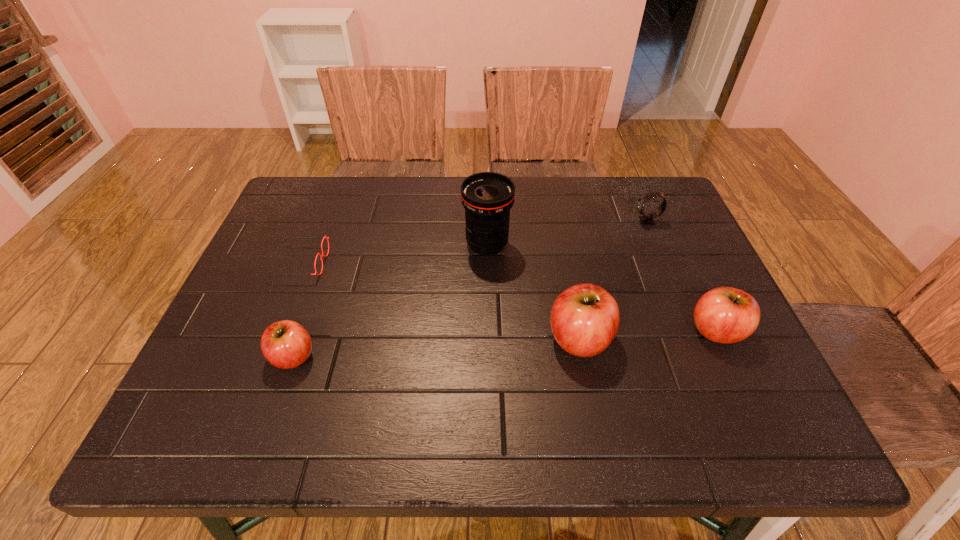
You are a GUI agent. You are given a task and a screenshot of the screen. Output one action in this format:
    pyautogui.click(x=<x>, y=<y>)
    Task: Click on the vacant space at the near right corner of the desktop
    
    Given the screenshot: What is the action you would take?
    pyautogui.click(x=762, y=395)

The height and width of the screenshot is (540, 960). Identify the location of unoccupied position between the tallest apple and the leftmost apple. (437, 348).

Where is `unoccupied position between the third tallest object and the fifth shortest object`? This screenshot has width=960, height=540. unoccupied position between the third tallest object and the fifth shortest object is located at coordinates (648, 335).

Find the location of `unoccupied position between the leftmost apple and the telephoto lens`. unoccupied position between the leftmost apple and the telephoto lens is located at coordinates (390, 300).

What are the coordinates of `blank region between the telephoto lens and the spectacles` in the screenshot? It's located at (394, 254).

Identify the location of vacant space that's between the tallest object and the leftmost apple. (390, 300).

I want to click on free spot between the tallest apple and the second tallest apple, so click(648, 335).

This screenshot has height=540, width=960. In order to click on free spot between the shortest object and the leftmost apple in this screenshot , I will do `click(297, 310)`.

Locate an element on the screen. vacant area that lies between the second shortest apple and the farthest object is located at coordinates (682, 276).

At what (x,y) coordinates should I click in order to perform the action: click on vacant space that's between the tallest object and the shortest apple. Please return your answer as a coordinate pair (x, y). The height and width of the screenshot is (540, 960). Looking at the image, I should click on (390, 300).